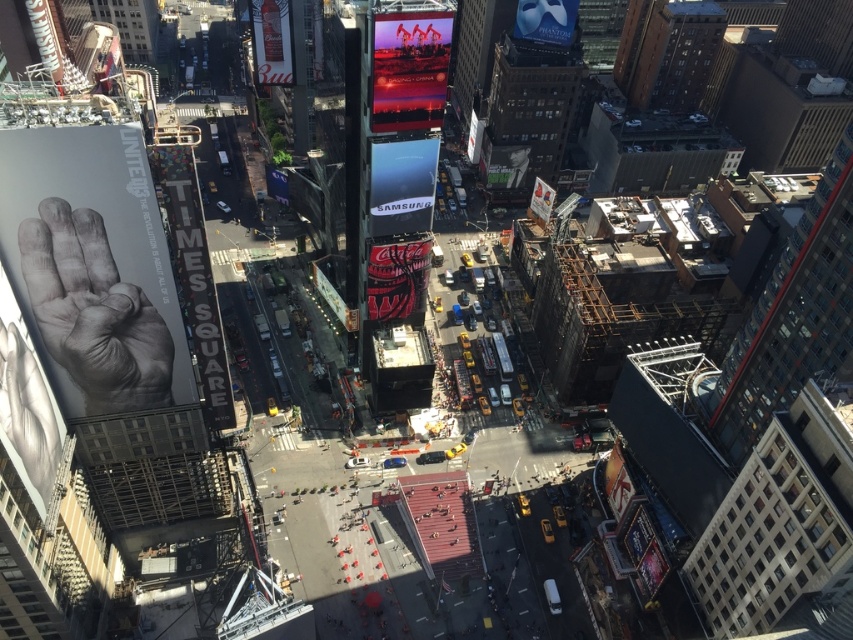
You are a drone operator flying a drone over Times Square. You notice the matte black samsung sign at center and the matte white mask at upper center. Which object is positioned closer to your drone?

The matte black samsung sign at center is closer to the viewer than the matte white mask at upper center, so the drone would detect the matte black samsung sign at center as being closer.